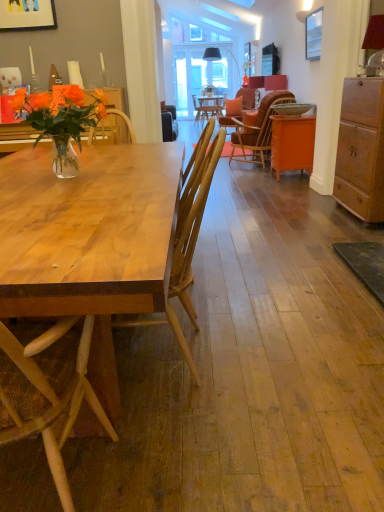
Question: Is wooden cabinet at right, the 1th cabinetry when ordered from front to back, wider or thinner than metallic silver picture frame at upper right, positioned as the 1th picture frame in back-to-front order?

Choices:
 (A) wide
 (B) thin

Answer: (A)

Question: Is point (345, 114) positioned closer to the camera than point (317, 38)?

Choices:
 (A) farther
 (B) closer

Answer: (B)

Question: Estimate the real-world distances between objects in this image. Which object is farther from the metallic silver picture frame at upper right, which ranks as the 2th picture frame in front-to-back order?

Choices:
 (A) wooden picture frame at upper left, the second picture frame when ordered from right to left
 (B) clear glass vase at upper left, acting as the first desk starting from the top
 (C) wooden cabinet at right, which is counted as the second cabinetry, starting from the back
 (D) matte white coffee cup at upper left
 (E) orange matte cabinet at right, which is counted as the 2th cabinetry, starting from the front

Answer: (B)

Question: Considering the real-world distances, which object is closest to the natural wood desk at left, which is the second desk from back to front?

Choices:
 (A) orange matte cabinet at right, marked as the 1th cabinetry in a back-to-front arrangement
 (B) matte white coffee cup at upper left
 (C) wooden picture frame at upper left, marked as the 1th picture frame in a front-to-back arrangement
 (D) clear glass vase at upper left, arranged as the 2th desk when viewed from the front
 (E) metallic silver picture frame at upper right, which ranks as the 2th picture frame in front-to-back order

Answer: (D)